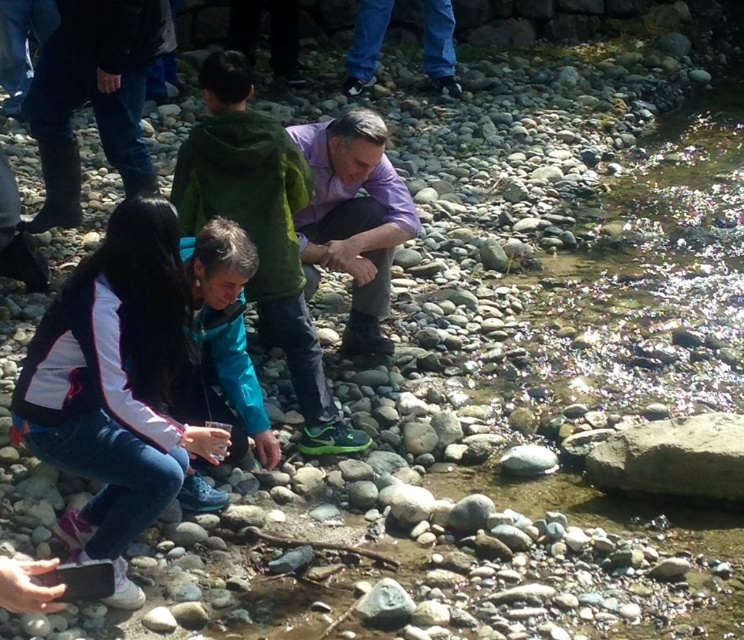
Question: Among these objects, which one is farthest from the camera?

Choices:
 (A) gray rough rock at lower right
 (B) purple cotton shirt at center
 (C) blue jeans at upper center
 (D) white matte jacket at lower left

Answer: (C)

Question: Which point is closer to the camera?

Choices:
 (A) purple cotton shirt at center
 (B) blue jeans at upper center
 (C) light purple shirt at center

Answer: (C)

Question: Among these objects, which one is farthest from the camera?

Choices:
 (A) white matte jacket at lower left
 (B) purple cotton shirt at center
 (C) blue jeans at upper center

Answer: (C)

Question: Does purple cotton shirt at center have a lesser width compared to blue jeans at upper center?

Choices:
 (A) no
 (B) yes

Answer: (A)

Question: Is light purple shirt at center positioned at the back of dark blue jeans at upper left?

Choices:
 (A) no
 (B) yes

Answer: (A)

Question: Is purple cotton shirt at center below teal fabric jacket at center?

Choices:
 (A) yes
 (B) no

Answer: (B)